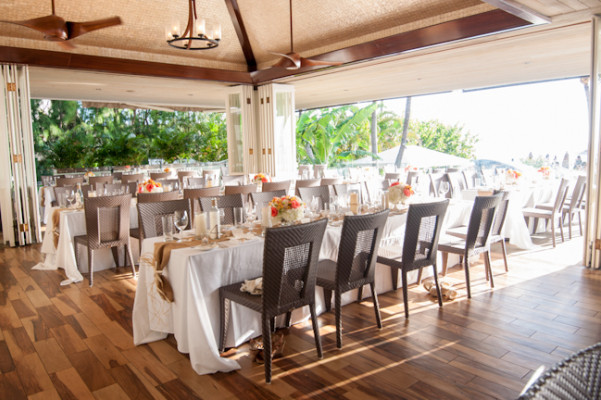
The height and width of the screenshot is (400, 601). I want to click on white table cloths, so click(207, 308), click(76, 224), click(38, 183), click(522, 201), click(418, 185), click(346, 172).